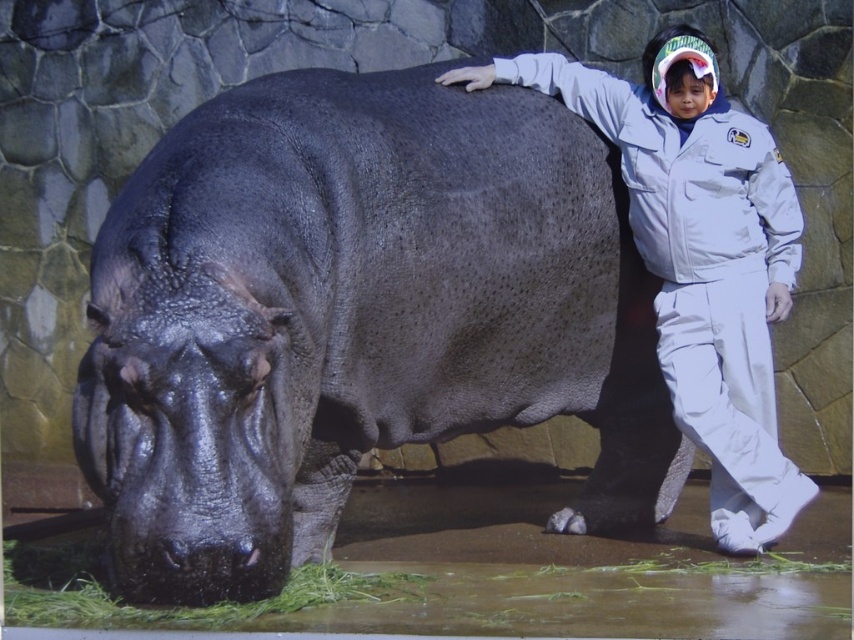
Is the position of white matte jacket at center more distant than that of green leafy grass at lower left?

Yes, it is behind green leafy grass at lower left.

In the scene shown: Can you confirm if white matte jacket at center is positioned below green leafy grass at lower left?

Actually, white matte jacket at center is above green leafy grass at lower left.

Measure the distance between point (x=771, y=532) and camera.

4.78 meters

Where is `white matte jacket at center`? Image resolution: width=854 pixels, height=640 pixels. white matte jacket at center is located at coordinates (699, 257).

Is shiny dark gray hippo at center thinner than green leafy grass at lower left?

No.

Looking at this image, does shiny dark gray hippo at center appear under green leafy grass at lower left?

No, shiny dark gray hippo at center is not below green leafy grass at lower left.

Is point (151, 371) positioned behind point (396, 595)?

No.

Find the location of a particular element. This screenshot has width=854, height=640. shiny dark gray hippo at center is located at coordinates (355, 317).

Looking at this image, is shiny dark gray hippo at center to the left of white matte jacket at center from the viewer's perspective?

Indeed, shiny dark gray hippo at center is positioned on the left side of white matte jacket at center.

Is shiny dark gray hippo at center positioned at the back of white matte jacket at center?

No, shiny dark gray hippo at center is in front of white matte jacket at center.

Who is more distant from viewer, (272,576) or (774,212)?

Point (774,212)

You are a GUI agent. You are given a task and a screenshot of the screen. Output one action in this format:
    pyautogui.click(x=<x>, y=<y>)
    Task: Click on the shiny dark gray hippo at center
    This screenshot has height=640, width=854.
    Given the screenshot: What is the action you would take?
    pyautogui.click(x=355, y=317)